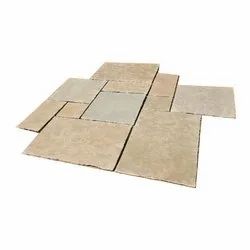
In order to click on inner tiles in this screenshot , I will do (76, 109), (107, 106), (124, 86), (162, 103).